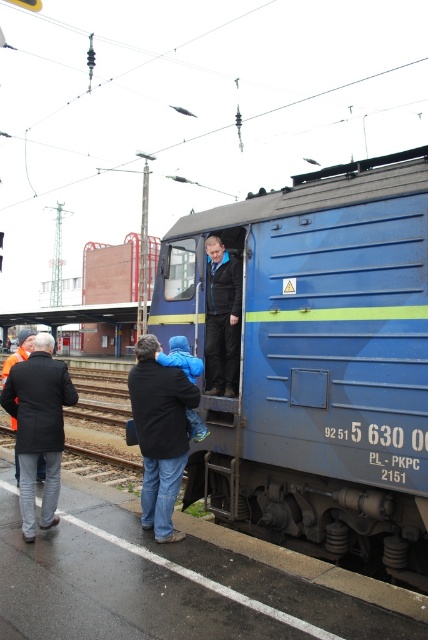
Measure the distance between black fabric jacket at center and camera.

black fabric jacket at center is 4.35 meters away from camera.

Based on the photo, can you confirm if black fabric jacket at center is positioned below dark gray wool coat at left?

Correct, black fabric jacket at center is located below dark gray wool coat at left.

Describe the element at coordinates (160, 435) in the screenshot. This screenshot has height=640, width=428. I see `black fabric jacket at center` at that location.

The height and width of the screenshot is (640, 428). Identify the location of black fabric jacket at center. pyautogui.click(x=160, y=435).

Which is below, black fabric jacket at center or dark blue leather jacket at center?

black fabric jacket at center is below.

Can you confirm if black fabric jacket at center is positioned to the left of dark blue leather jacket at center?

Indeed, black fabric jacket at center is positioned on the left side of dark blue leather jacket at center.

Describe the element at coordinates (160, 435) in the screenshot. I see `black fabric jacket at center` at that location.

This screenshot has height=640, width=428. What are the coordinates of `black fabric jacket at center` in the screenshot? It's located at (160, 435).

Who is lower down, blue matte train at center or black fabric jacket at center?

black fabric jacket at center

Is point (285, 499) less distant than point (168, 499)?

No, (285, 499) is further to viewer.

At what (x,y) coordinates should I click in order to perform the action: click on blue matte train at center. Please return your answer as a coordinate pair (x, y). This screenshot has width=428, height=640. Looking at the image, I should click on (317, 362).